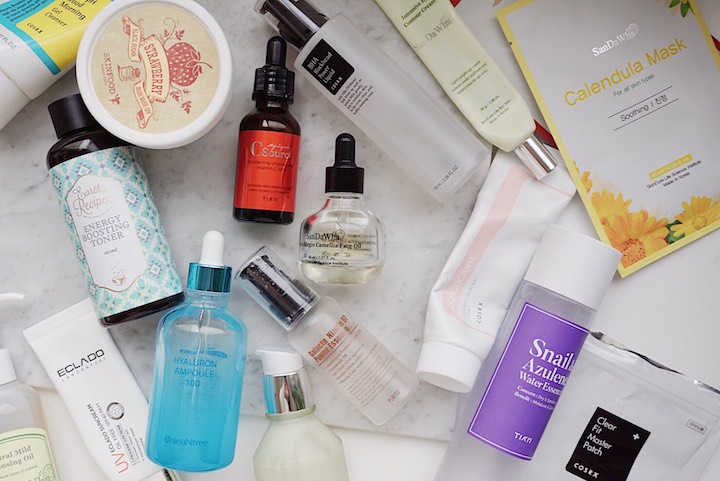
Where is `bottles`? bottles is located at coordinates (114, 256), (184, 360), (315, 322), (351, 244), (276, 189), (364, 124), (539, 350).